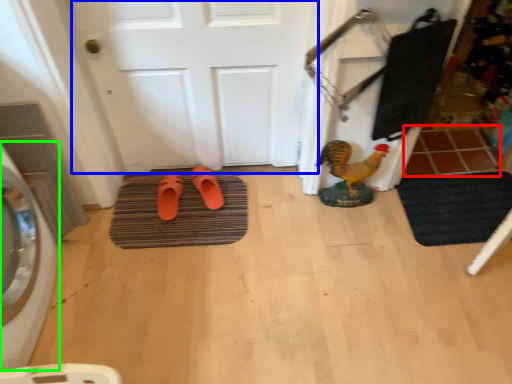
Question: Which object is the farthest from tile (highlighted by a red box)? Choose among these: door (highlighted by a blue box) or washing machine (highlighted by a green box).

Choices:
 (A) door
 (B) washing machine

Answer: (B)